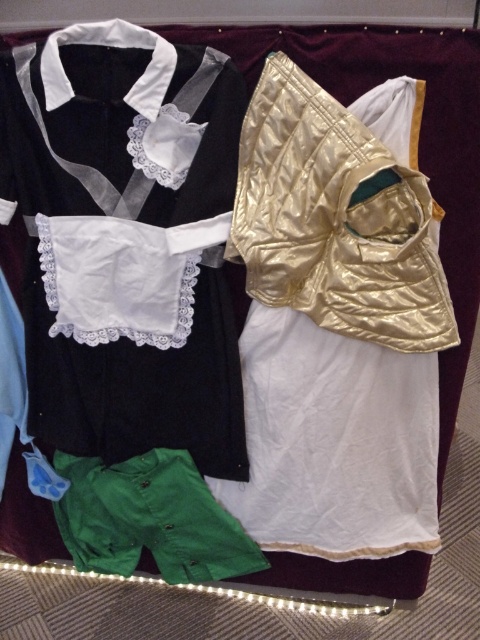
You are organizing a clothing store and need to hang the black velvet shirt at upper left and the green cotton shorts at lower left. Since the hanger for the black velvet shirt is above the green cotton shorts, does this mean the shirt is placed higher than the shorts?

Yes, the black velvet shirt at upper left is positioned over the green cotton shorts at lower left, so it is placed higher.

You are a tailor measuring the distance between garments on a display. The gold quilted dress at upper right and the green cotton shorts at lower left need to be spaced exactly 10 inches apart for proper display. Based on the image, is the current spacing between them sufficient?

The distance between the gold quilted dress at upper right and the green cotton shorts at lower left is 10.06 inches, which is slightly more than the required 10 inches. Therefore, the current spacing is sufficient for proper display.